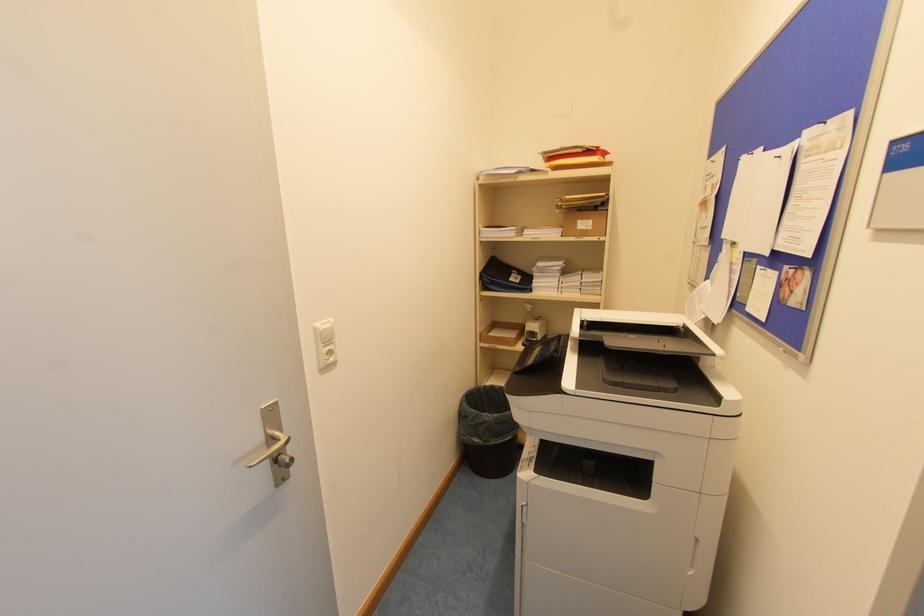
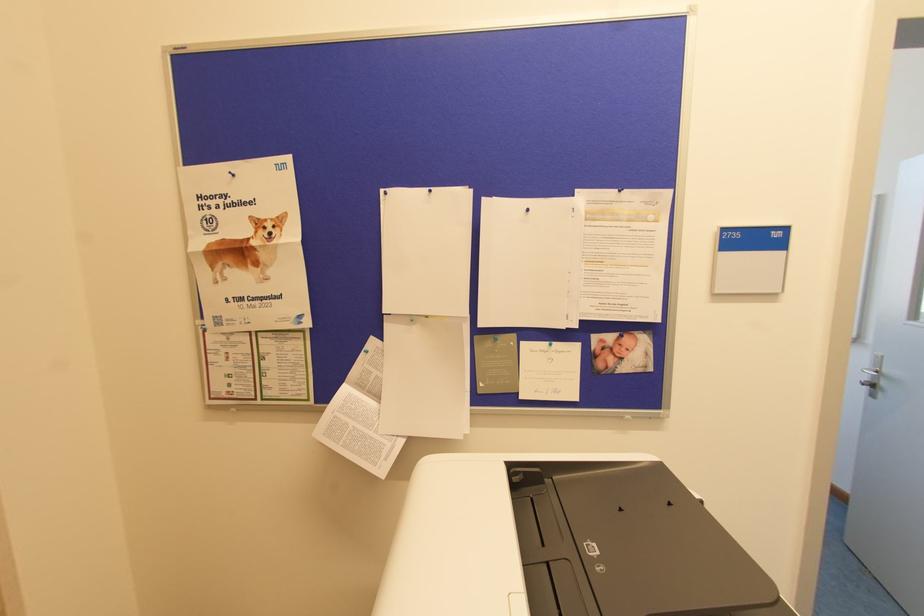
The point at (825, 122) is marked in the first image. Where is the corresponding point in the second image?

(619, 190)